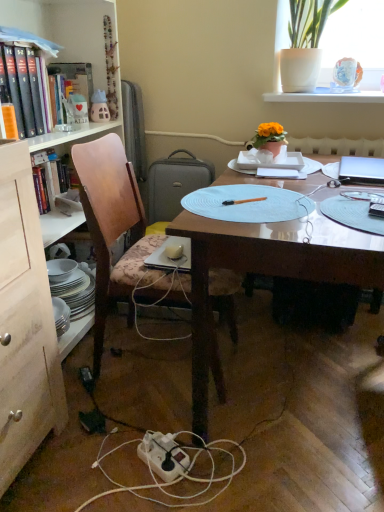
Where is `free area in between wooden chair at left and white plastic power plugs and sockets at lower center, the 2th power plugs and sockets in the back-to-front sequence`? This screenshot has width=384, height=512. free area in between wooden chair at left and white plastic power plugs and sockets at lower center, the 2th power plugs and sockets in the back-to-front sequence is located at coordinates (131, 411).